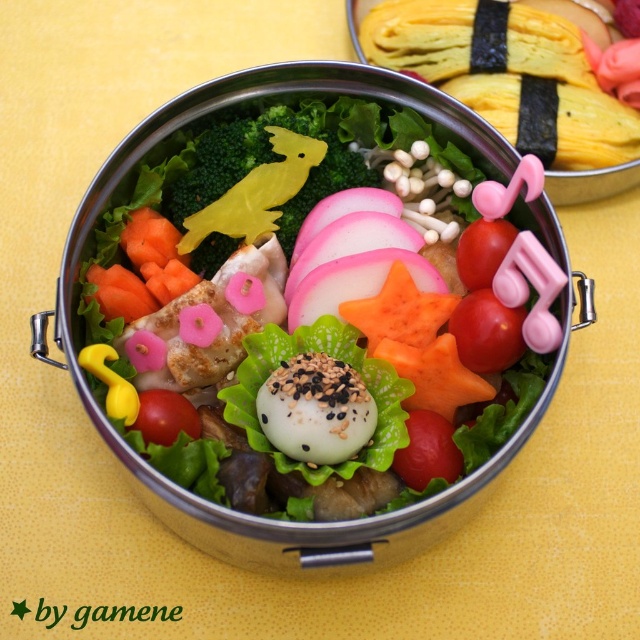
In the scene shown: You are a food critic evaluating the bento box. You need to determine if the white glossy rice ball at center can completely cover the green matte broccoli at center when placed directly on top. Based on their sizes, what is your conclusion?

The white glossy rice ball at center is bigger than the green matte broccoli at center, so it can completely cover the broccoli when placed directly on top.

You are a food critic evaluating the presentation of this bento box. You notice the white glossy rice ball at center and the green matte broccoli at center. Based on their appearance, which object do you think occupies more horizontal space in the bento box?

The white glossy rice ball at center might be wider than green matte broccoli at center, so it likely occupies more horizontal space in the bento box.

You are a food stylist arranging a bento box. You have a white glossy rice ball at center and a pink translucent onion at center. Which object is wider?

The white glossy rice ball at center is wider than the pink translucent onion at center according to the description.